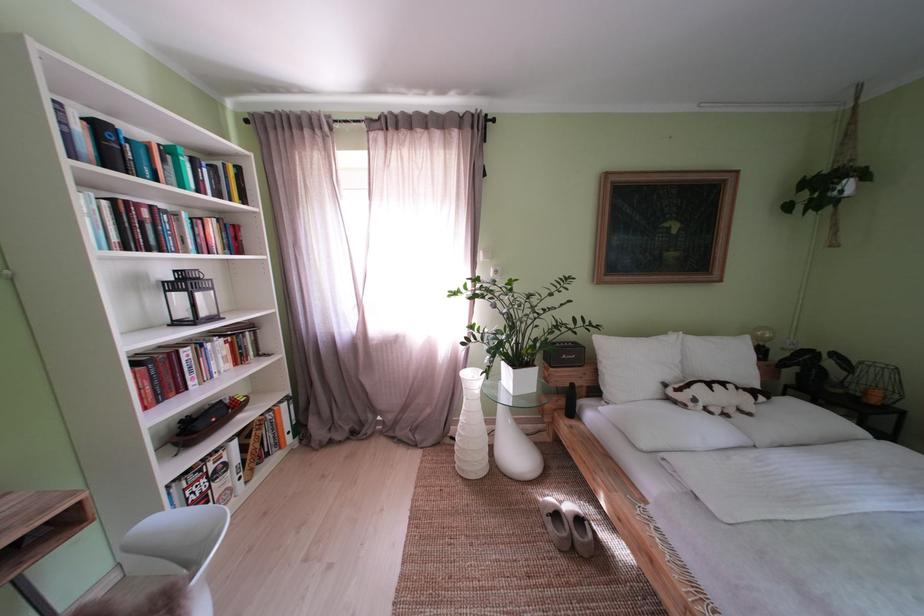
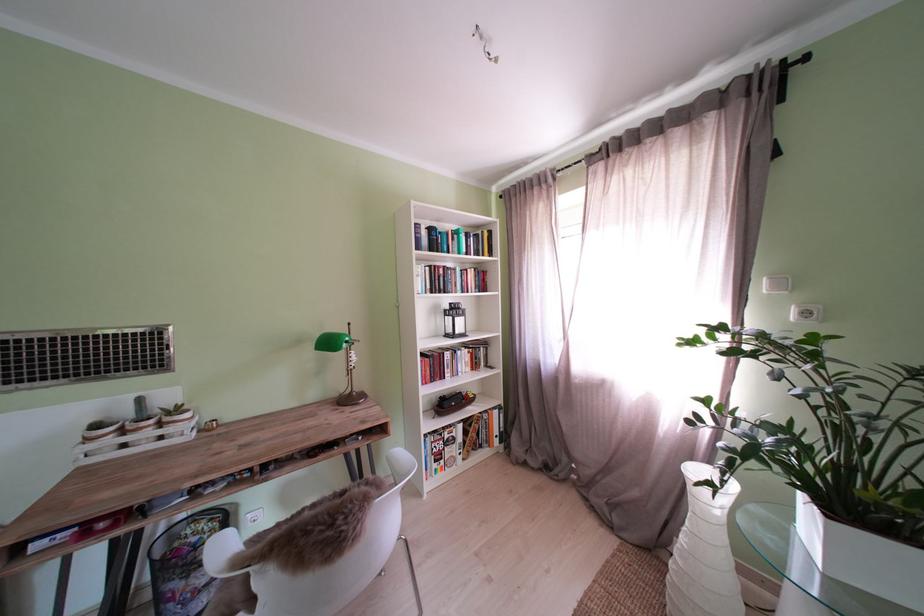
Locate, in the second image, the point that corresponds to the point at 456,450 in the first image.

(670, 564)